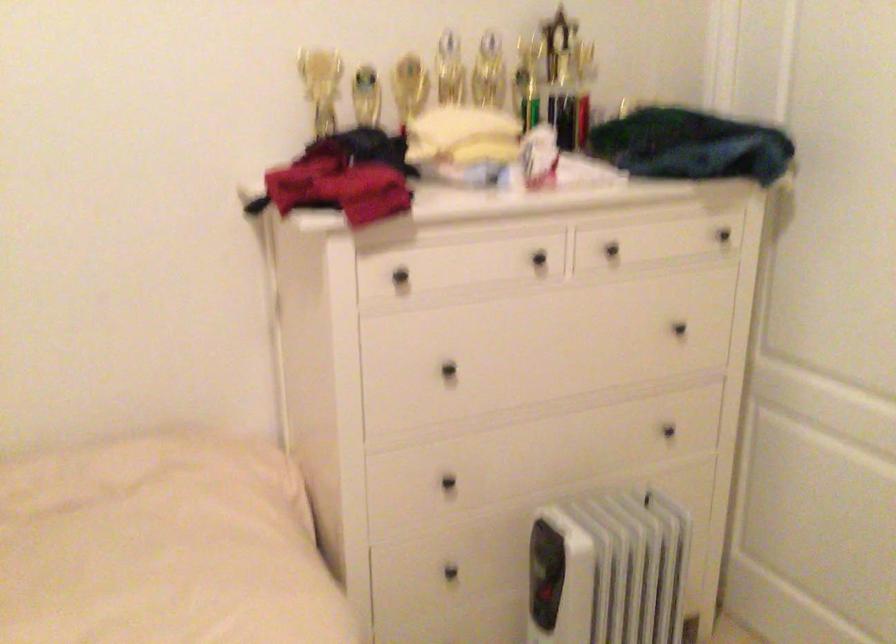
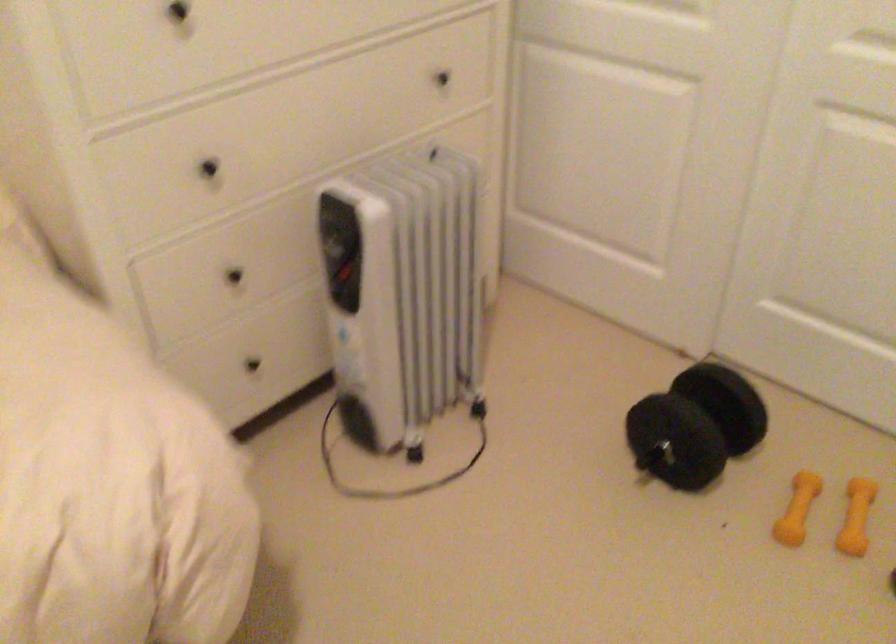
What movement of the cameraman would produce the second image?

The movement direction of the cameraman is left, forward.